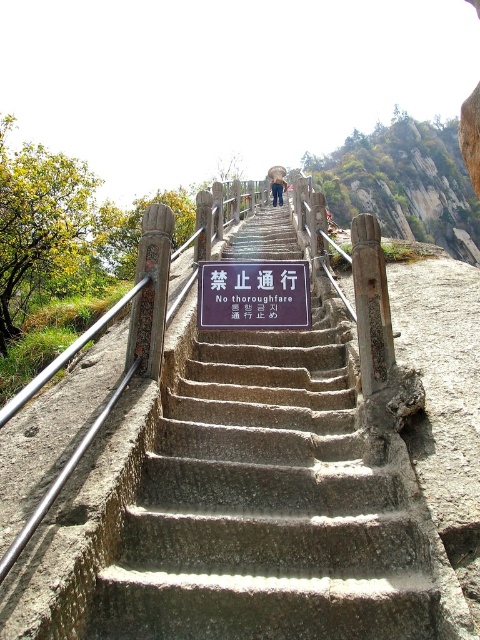
You are a hiker standing at the base of the staircase. You see a point marked at coordinates (253, 296). What object does this point correspond to?

The point corresponds to the metallic rectangular sign at center.

Based on the photo, you are a hiker planning to climb the steep, narrow staircase carved into the rocky cliffside. There is a metallic rectangular sign at center. Where should you look to see the sign before starting your climb?

The metallic rectangular sign at center is located at the base of the staircase, so you should look at the base of the staircase to see the sign before starting your climb.